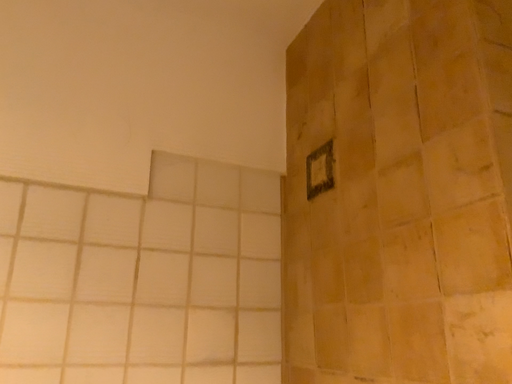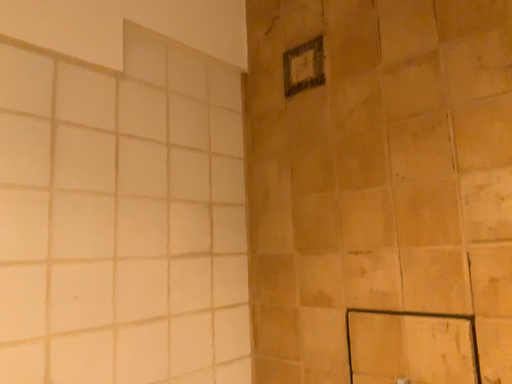
Question: How did the camera likely rotate when shooting the video?

Choices:
 (A) rotated left
 (B) rotated right

Answer: (B)